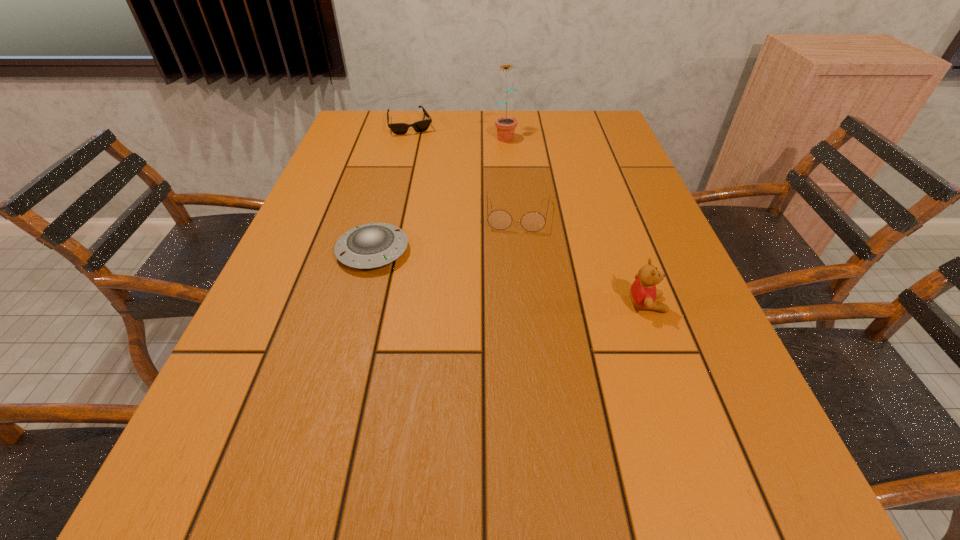
The width and height of the screenshot is (960, 540). Find the location of `saucer`. saucer is located at coordinates (372, 245).

This screenshot has height=540, width=960. Identify the location of the rightmost object. (643, 292).

In order to click on the nearest object in this screenshot , I will do `click(643, 292)`.

This screenshot has width=960, height=540. I want to click on sunflower, so click(x=506, y=125).

At what (x,y) coordinates should I click in order to perform the action: click on the third shortest object. Please return your answer as a coordinate pair (x, y). Looking at the image, I should click on (498, 219).

Locate an element on the screen. sunglasses is located at coordinates (420, 126).

Locate an element on the screen. vacant space situated on the right of the saucer is located at coordinates (477, 251).

The height and width of the screenshot is (540, 960). What are the coordinates of `free space located on the front-facing side of the teddy bear` in the screenshot? It's located at (693, 304).

At what (x,y) coordinates should I click in order to perform the action: click on vacant area situated on the flower of the tallest object. Please return your answer as a coordinate pair (x, y). The image size is (960, 540). Looking at the image, I should click on (519, 199).

Where is `free point located 0.270m on the flower of the tallest object`? The image size is (960, 540). free point located 0.270m on the flower of the tallest object is located at coordinates (517, 191).